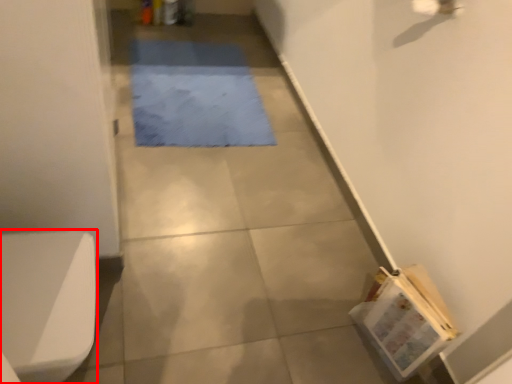
Question: Where is toilet bowl (annotated by the red box) located in relation to mat in the image?

Choices:
 (A) left
 (B) right

Answer: (A)